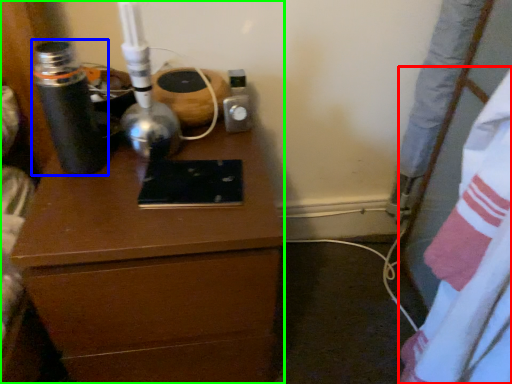
Question: Considering the real-world distances, which object is closest to sheet (highlighted by a red box)? bottle (highlighted by a blue box) or chest of drawers (highlighted by a green box).

Choices:
 (A) bottle
 (B) chest of drawers

Answer: (B)